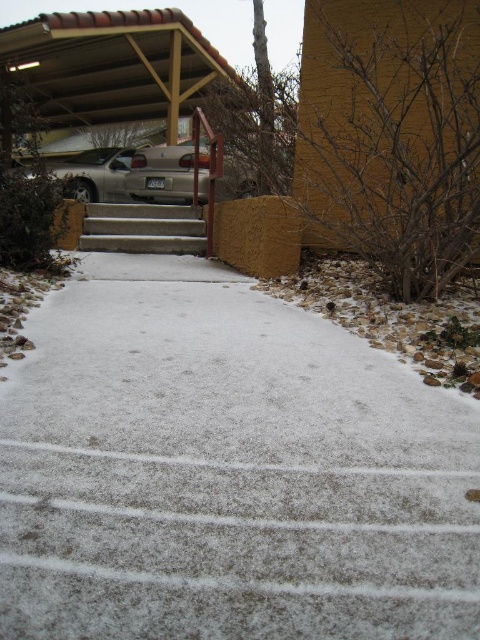
Question: Estimate the real-world distances between objects in this image. Which object is closer to the white concrete steps at center?

Choices:
 (A) satin silver car at upper left
 (B) silver metallic sedan at center

Answer: (B)

Question: Which of these objects is positioned farthest from the silver metallic sedan at center?

Choices:
 (A) white concrete steps at center
 (B) satin silver car at upper left

Answer: (A)

Question: Which point is farther from the camera taking this photo?

Choices:
 (A) (180, 179)
 (B) (200, 240)
 (C) (92, 177)

Answer: (C)

Question: Is the position of white concrete steps at center less distant than that of satin silver car at upper left?

Choices:
 (A) no
 (B) yes

Answer: (B)

Question: Can you confirm if concrete stairs at center is positioned to the right of satin silver car at upper left?

Choices:
 (A) no
 (B) yes

Answer: (B)

Question: Does white concrete steps at center have a lesser width compared to concrete stairs at center?

Choices:
 (A) yes
 (B) no

Answer: (B)